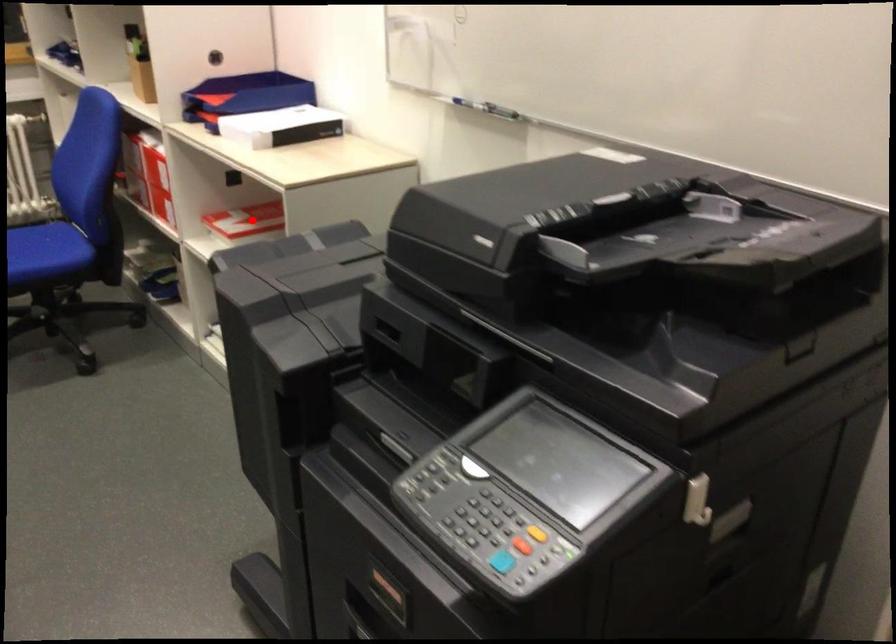
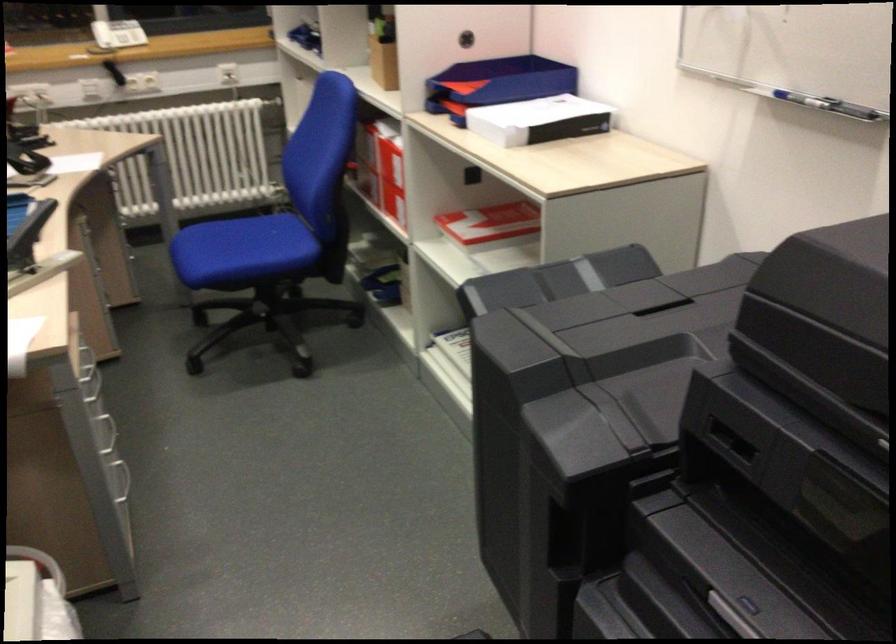
The point at the highlighted location is marked in the first image. Where is the corresponding point in the second image?

(489, 223)